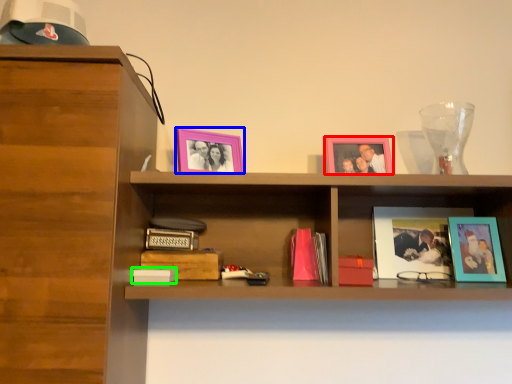
Question: Which object is positioned farthest from picture frame (highlighted by a red box)? Select from picture frame (highlighted by a blue box) and paperback book (highlighted by a green box).

Choices:
 (A) picture frame
 (B) paperback book

Answer: (B)